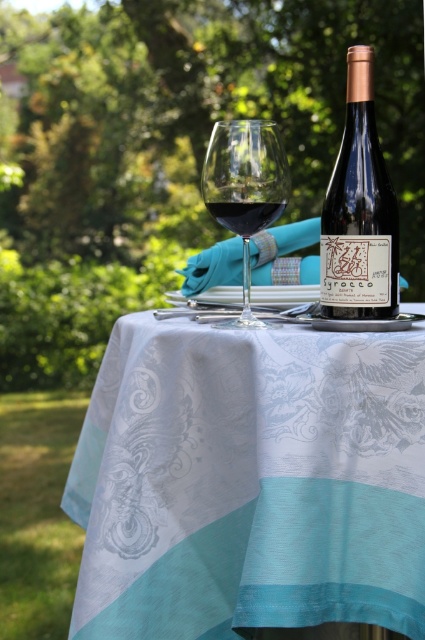
Does silky blue tablecloth at center have a smaller size compared to transparent glass at center?

Actually, silky blue tablecloth at center might be larger than transparent glass at center.

Is point (356, 547) less distant than point (223, 170)?

Yes.

Between point (221, 572) and point (278, 176), which one is positioned in front?

Point (221, 572)

I want to click on silky blue tablecloth at center, so click(x=249, y=481).

Who is taller, transparent glass at center or silky teal tablecloth at center?

transparent glass at center

Who is more forward, (x=241, y=164) or (x=309, y=227)?

Point (x=241, y=164) is more forward.

Which is behind, point (240, 204) or point (237, 240)?

Positioned behind is point (237, 240).

Where is `transparent glass at center`? This screenshot has height=640, width=425. transparent glass at center is located at coordinates pos(244,188).

Who is lower down, silky blue tablecloth at center or dark red glass at center?

silky blue tablecloth at center is lower down.

Measure the distance between silky blue tablecloth at center and camera.

The distance of silky blue tablecloth at center from camera is 13.13 inches.

You are a GUI agent. You are given a task and a screenshot of the screen. Output one action in this format:
    pyautogui.click(x=<x>, y=<y>)
    Task: Click on the silky blue tablecloth at center
    
    Given the screenshot: What is the action you would take?
    pyautogui.click(x=249, y=481)